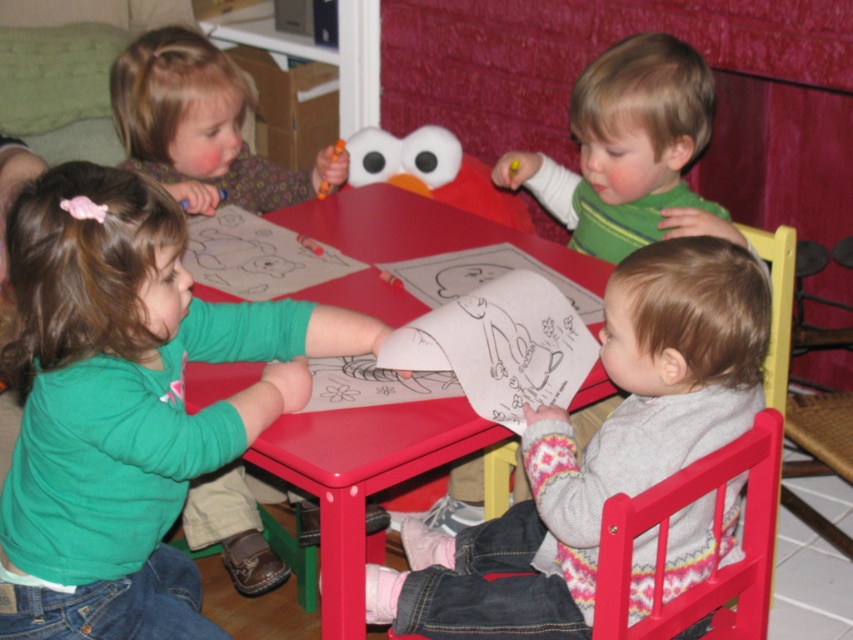
You are a teacher observing the children at the small red table. You notice the green matte shirt at upper right and the matte orange crayon at upper left. Which object appears narrower?

The green matte shirt at upper right is narrower than the matte orange crayon at upper left according to the description.